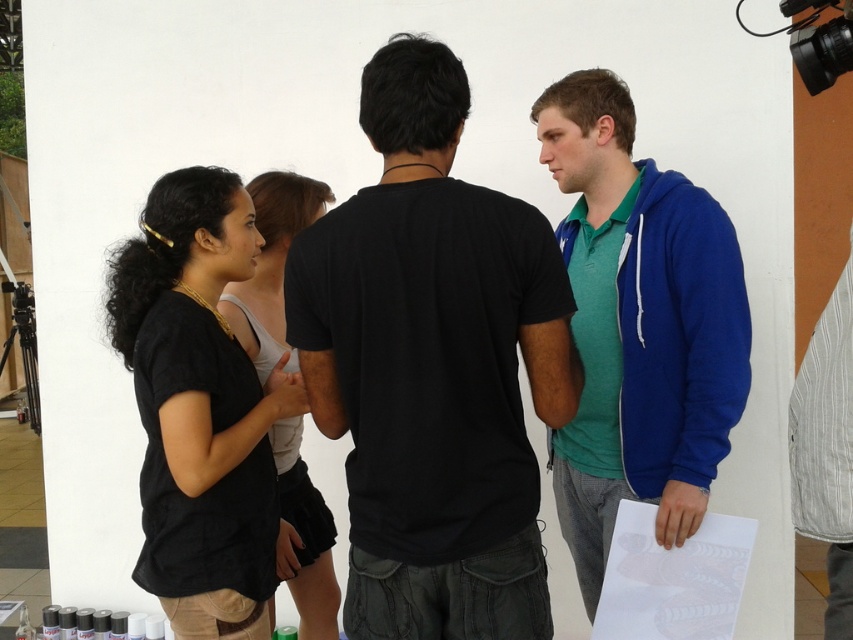
Who is lower down, blue fleece jacket at right or black matte shirt at center?

black matte shirt at center

Who is more distant from viewer, (712, 216) or (287, 244)?

Positioned behind is point (287, 244).

Between point (590, 502) and point (270, 364), which one is positioned behind?

Positioned behind is point (590, 502).

This screenshot has height=640, width=853. Find the location of `blue fleece jacket at right`. blue fleece jacket at right is located at coordinates 637,326.

Which is more to the left, black matte shirt at center or gray striped shirt at right?

black matte shirt at center

What do you see at coordinates (271, 266) in the screenshot? The image size is (853, 640). I see `black matte shirt at center` at bounding box center [271, 266].

Describe the element at coordinates (271, 266) in the screenshot. I see `black matte shirt at center` at that location.

Image resolution: width=853 pixels, height=640 pixels. Find the location of `black matte shirt at center`. black matte shirt at center is located at coordinates (271, 266).

Which of these two, black linen shirt at center or black matte shirt at center, stands shorter?

With less height is black linen shirt at center.

Who is taller, black linen shirt at center or black matte shirt at center?

Standing taller between the two is black matte shirt at center.

Based on the photo, who is more forward, (x=158, y=202) or (x=262, y=195)?

Positioned in front is point (x=158, y=202).

Identify the location of black linen shirt at center. Image resolution: width=853 pixels, height=640 pixels. (200, 408).